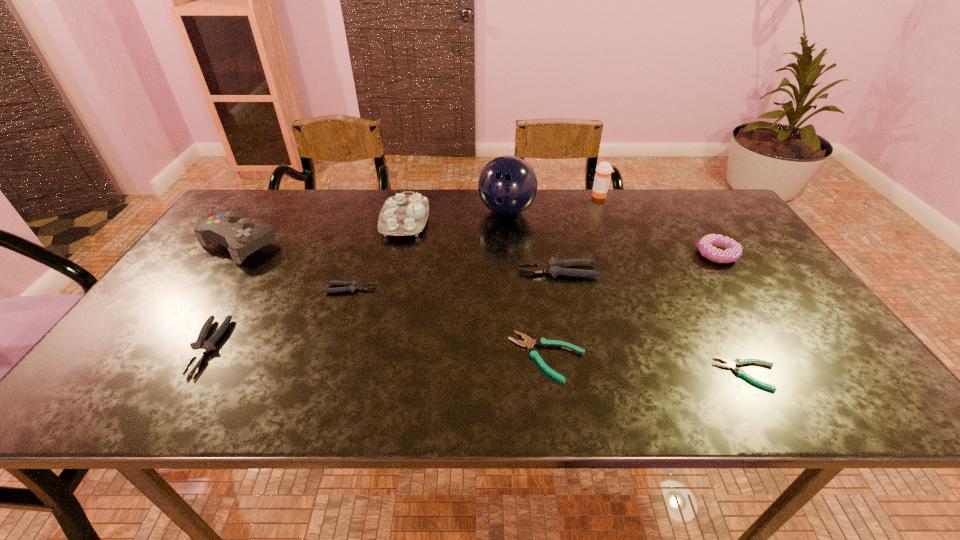
Point out which gray pliers is positioned as the nearest to the eighth object from left to right. Please provide its 2D coordinates. Your answer should be formatted as a tuple, i.e. [(x, y)], where the tuple contains the x and y coordinates of a point satisfying the conditions above.

[(554, 267)]

At what (x,y) coordinates should I click in order to perform the action: click on vacant space that satisfies the following two spatial constraints: 1. on the surface of the tallest object near the finger holes; 2. at the gripping part of the second farthest pliers. Please return your answer as a coordinate pair (x, y). The width and height of the screenshot is (960, 540). Looking at the image, I should click on (513, 288).

The width and height of the screenshot is (960, 540). I want to click on free space that satisfies the following two spatial constraints: 1. at the gripping part of the shortest object; 2. on the right side of the fourth nearest pliers, so click(323, 374).